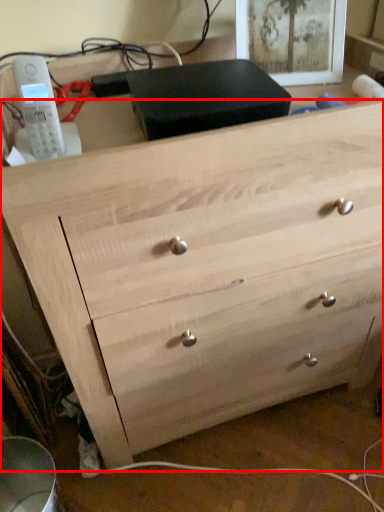
Question: From the image's perspective, what is the correct spatial positioning of chest of drawers (annotated by the red box) in reference to picture frame?

Choices:
 (A) above
 (B) below

Answer: (B)